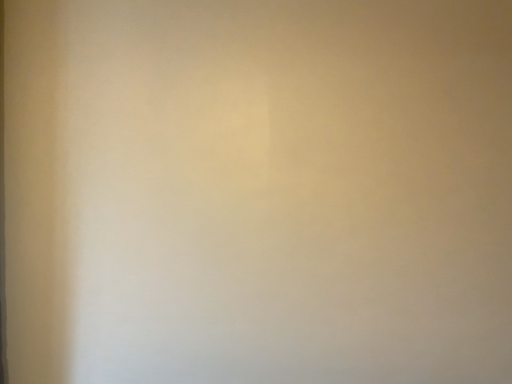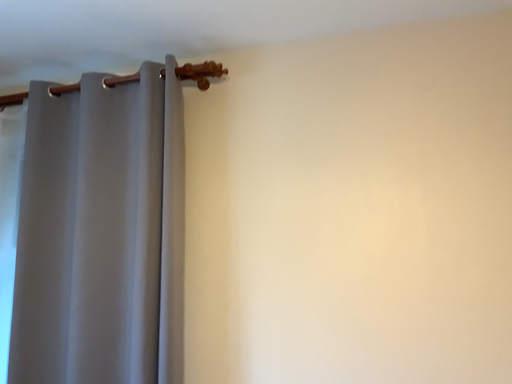
Question: Which way did the camera rotate in the video?

Choices:
 (A) rotated upward
 (B) rotated downward

Answer: (A)